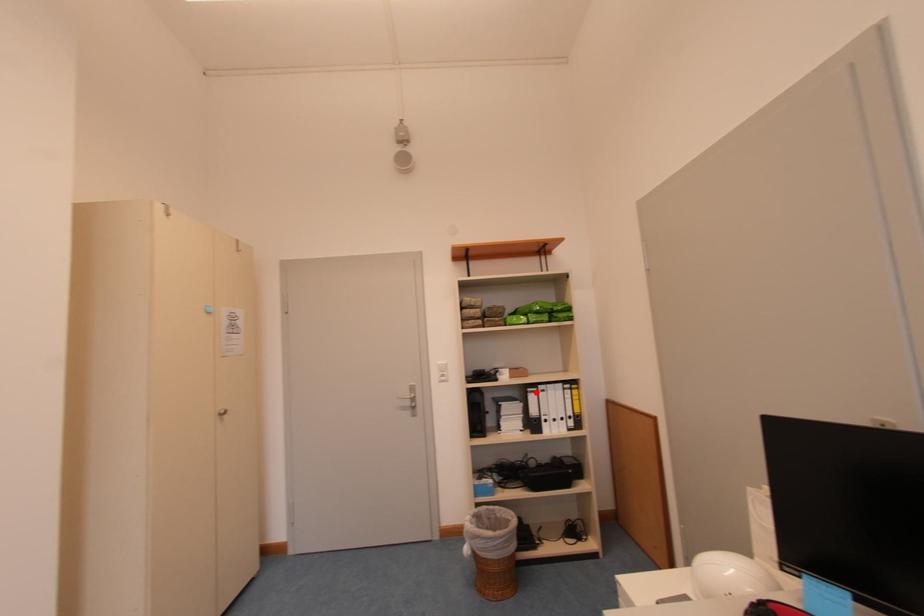
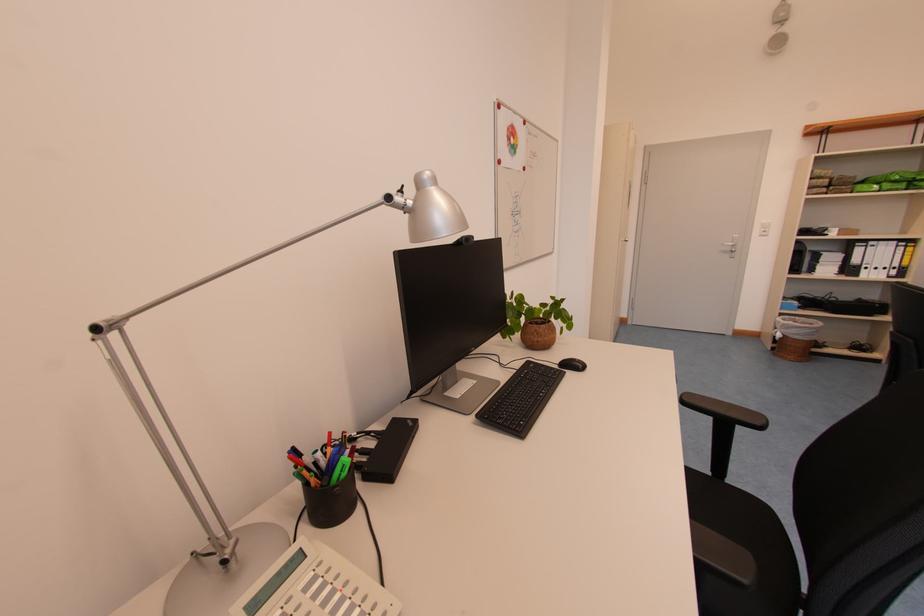
In the second image, find the point that corresponds to the highlighted location in the first image.

(865, 246)